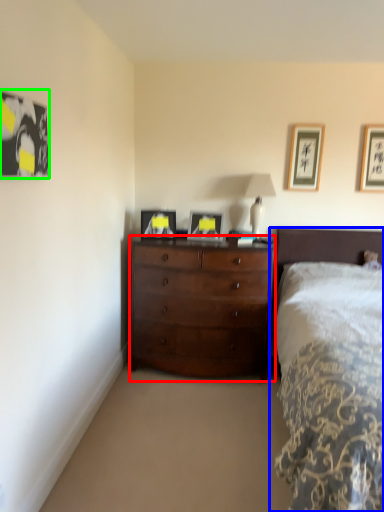
Question: Considering the real-world distances, which object is farthest from chest of drawers (highlighted by a red box)? bed (highlighted by a blue box) or picture frame (highlighted by a green box)?

Choices:
 (A) bed
 (B) picture frame

Answer: (B)